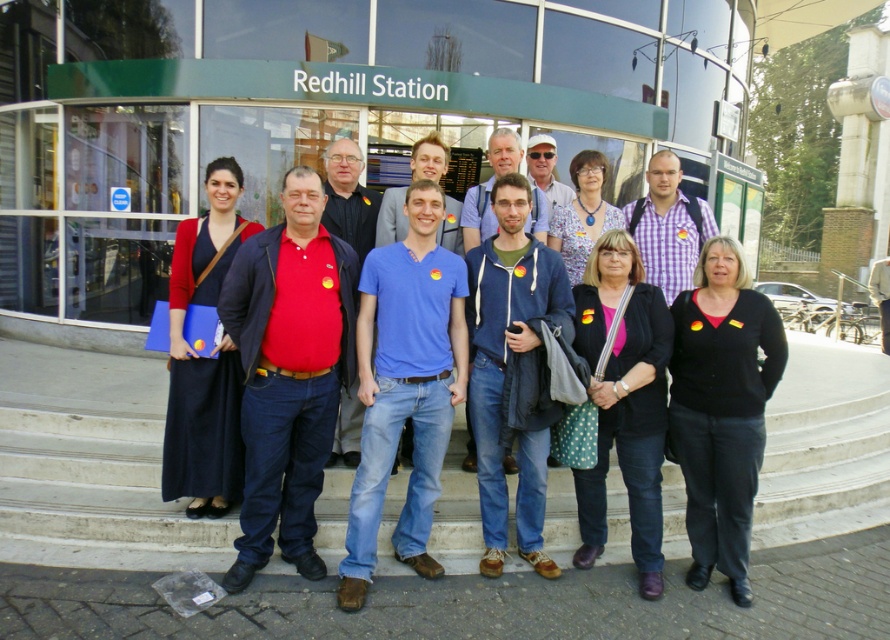
Question: Which object appears closest to the camera in this image?

Choices:
 (A) blue cotton hoodie at center
 (B) floral fabric blouse at center
 (C) matte black dress at center

Answer: (A)

Question: Considering the real-world distances, which object is closest to the blue cotton shirt at center?

Choices:
 (A) matte red shirt at center
 (B) black matte sweater at center
 (C) matte black dress at center

Answer: (A)

Question: Is matte red shirt at center closer to the viewer compared to black matte jacket at center?

Choices:
 (A) yes
 (B) no

Answer: (A)

Question: Can you confirm if black matte jacket at center is smaller than blue cotton hoodie at center?

Choices:
 (A) no
 (B) yes

Answer: (B)

Question: Considering the relative positions of blue cotton shirt at center and black matte jacket at center in the image provided, where is blue cotton shirt at center located with respect to black matte jacket at center?

Choices:
 (A) below
 (B) above

Answer: (B)

Question: Among these points, which one is nearest to the camera?

Choices:
 (A) (522, 321)
 (B) (704, 349)
 (C) (281, 484)

Answer: (B)